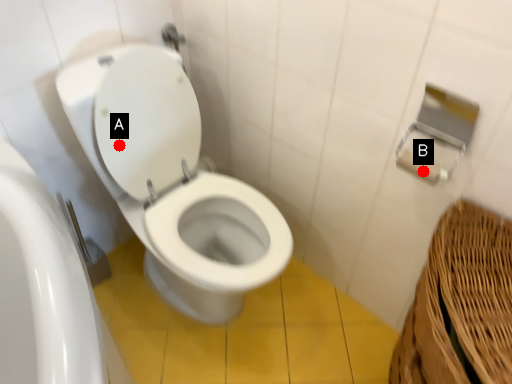
Question: Two points are circled on the image, labeled by A and B beside each circle. Which point is closer to the camera?

Choices:
 (A) A is closer
 (B) B is closer

Answer: (B)